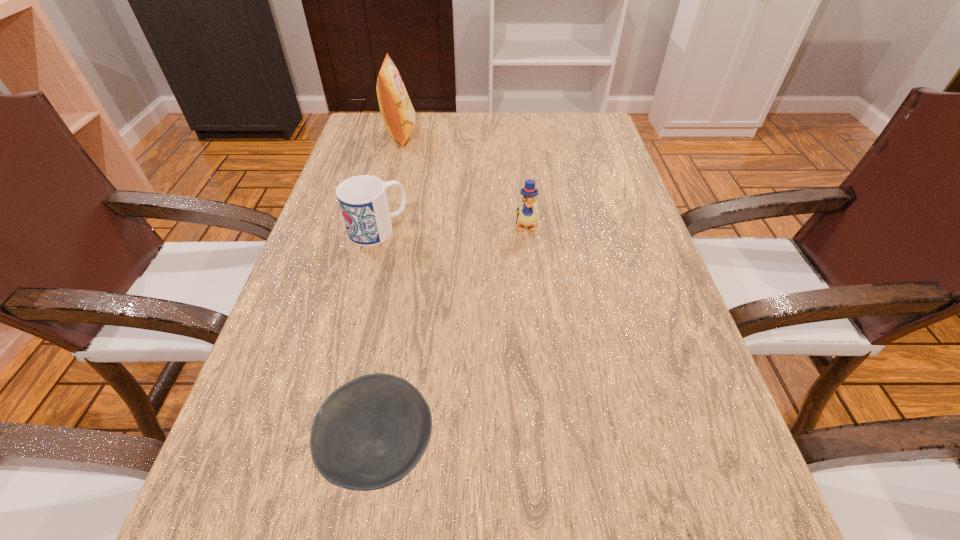
Identify the location of free space between the shortest object and the mug. This screenshot has height=540, width=960. (379, 339).

Find the location of a particular element. The image size is (960, 540). vacant area that lies between the duckling and the mug is located at coordinates (451, 228).

The width and height of the screenshot is (960, 540). What are the coordinates of `free area in between the bowl and the duckling` in the screenshot? It's located at (452, 338).

Identify the location of blank region between the crisp (potato chip) and the rightmost object. This screenshot has height=540, width=960. (463, 180).

You are a GUI agent. You are given a task and a screenshot of the screen. Output one action in this format:
    pyautogui.click(x=<x>, y=<y>)
    Task: Click on the vacant space in between the bowl and the tallest object
    This screenshot has width=960, height=540.
    Given the screenshot: What is the action you would take?
    pyautogui.click(x=391, y=291)

Find the location of a particular element. The width and height of the screenshot is (960, 540). free space between the nearest object and the farthest object is located at coordinates (391, 291).

Locate an element on the screen. vacant space that's between the shortest object and the rightmost object is located at coordinates (452, 338).

I want to click on free space between the nearest object and the mug, so click(x=379, y=339).

Locate an element on the screen. object that can be found as the closest to the crisp (potato chip) is located at coordinates (363, 202).

You are a GUI agent. You are given a task and a screenshot of the screen. Output one action in this format:
    pyautogui.click(x=<x>, y=<y>)
    Task: Click on the object identified as the second closest to the mug
    This screenshot has width=960, height=540.
    Given the screenshot: What is the action you would take?
    pyautogui.click(x=398, y=114)